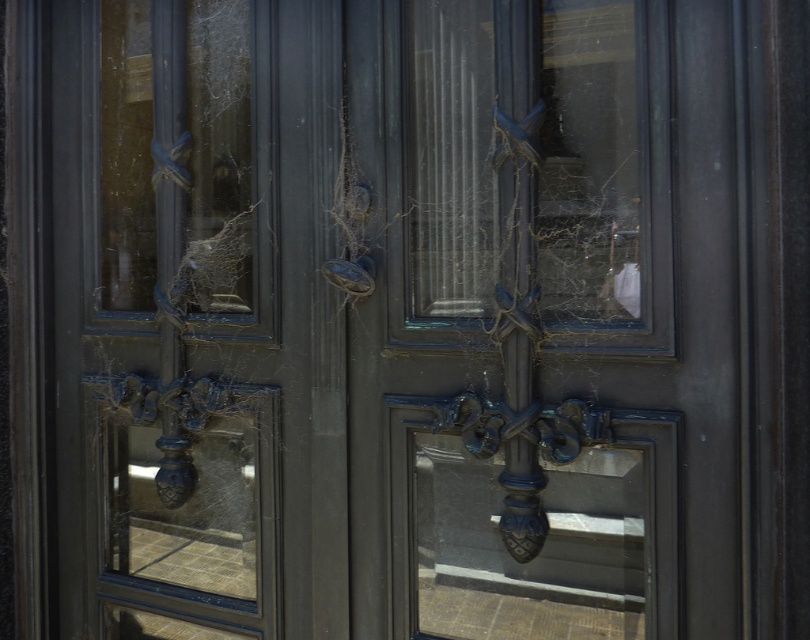
Can you confirm if matte dark blue screen door at center is wider than matte dark blue door at center?

In fact, matte dark blue screen door at center might be narrower than matte dark blue door at center.

Is matte dark blue screen door at center above matte dark blue door at center?

Correct, matte dark blue screen door at center is located above matte dark blue door at center.

Who is more forward, (484, 550) or (327, 136)?

Point (484, 550) is more forward.

This screenshot has height=640, width=810. Identify the location of matte dark blue screen door at center. (544, 321).